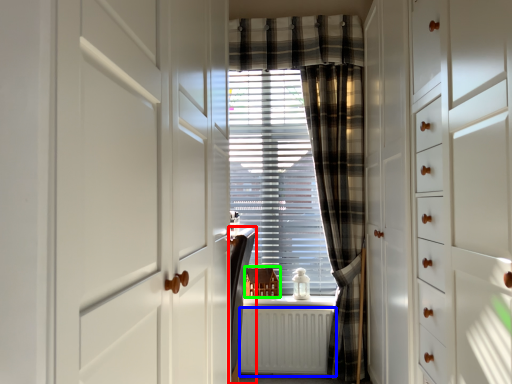
Question: Based on their relative distances, which object is farther from furniture (highlighted by a red box)? Choose from radiator (highlighted by a blue box) and furniture (highlighted by a green box).

Choices:
 (A) radiator
 (B) furniture

Answer: (B)